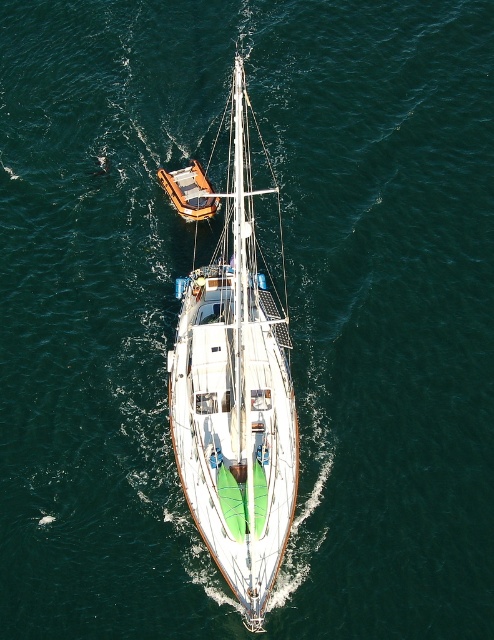
You are a passenger on the white glossy sailboat at center and want to move to the orange matte dinghy at upper center. Which direction should you go to reach it?

The white glossy sailboat at center is to the right of the orange matte dinghy at upper center, so you should go to the left to reach it.

You are a passenger on the white glossy sailboat at center and want to move to the orange matte dinghy at upper center. Which direction should you go to reach it?

The white glossy sailboat at center is in front of the orange matte dinghy at upper center, so you should move backward to reach the orange matte dinghy at upper center.

You are a passenger on the white glossy sailboat at center and want to transfer to the orange matte dinghy at upper center. Can you safely walk from the sailboat to the dinghy without needing a boat? Explain your reasoning.

The white glossy sailboat at center and orange matte dinghy at upper center are 16.55 meters apart from each other. Since the distance between them is over 16 meters, it is not possible to walk between them without a boat or other means of transport.